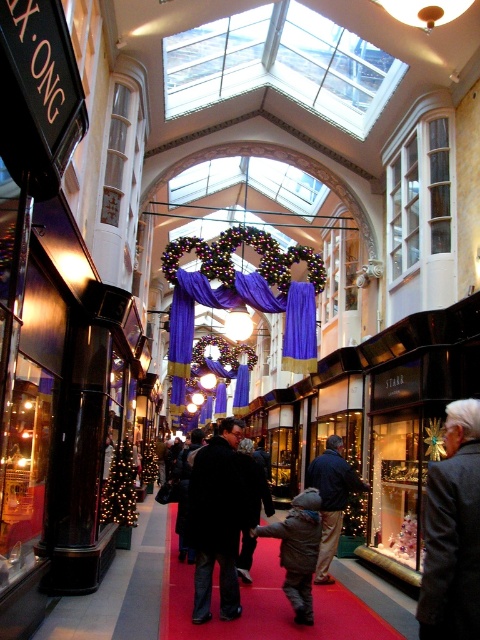
Question: Which object is farther from the camera taking this photo?

Choices:
 (A) purple velvet curtain at center
 (B) brown fuzzy coat at center
 (C) dark gray wool coat at center
 (D) dark blue jacket at center

Answer: (A)

Question: Can you confirm if dark gray wool coat at center is wider than dark wool coat at center?

Choices:
 (A) no
 (B) yes

Answer: (A)

Question: Does dark gray wool coat at center have a lesser width compared to dark wool coat at center?

Choices:
 (A) yes
 (B) no

Answer: (A)

Question: Which of the following is the farthest from the observer?

Choices:
 (A) dark gray wool coat at center
 (B) brown fuzzy coat at center

Answer: (B)

Question: Which object appears closest to the camera in this image?

Choices:
 (A) brown fuzzy coat at center
 (B) dark wool coat at center
 (C) dark gray wool coat at center
 (D) purple velvet curtain at center

Answer: (C)

Question: Is dark wool coat at center to the right of dark blue jacket at center from the viewer's perspective?

Choices:
 (A) yes
 (B) no

Answer: (B)